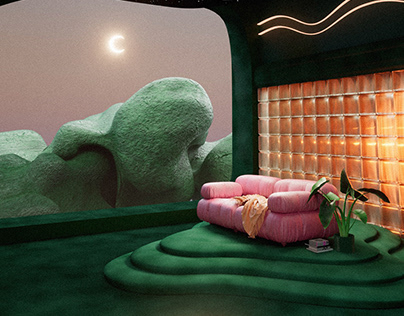
You are a GUI agent. You are given a task and a screenshot of the screen. Output one action in this format:
    pyautogui.click(x=<x>, y=<y>)
    Task: Click on the book stack
    The height and width of the screenshot is (316, 404).
    Given the screenshot: What is the action you would take?
    [320, 248]